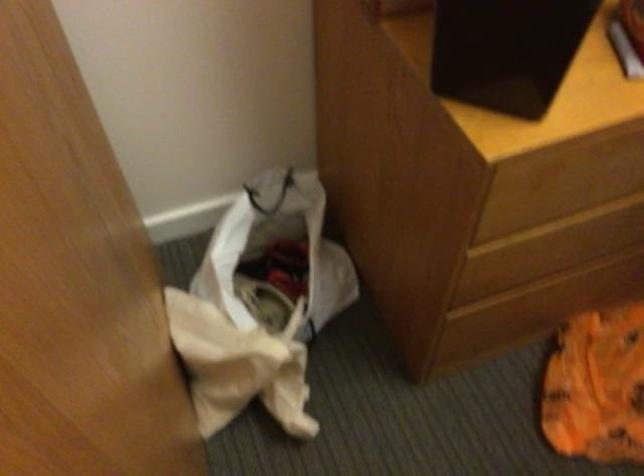
Image resolution: width=644 pixels, height=476 pixels. Identify the location of black bag handle. (269, 189).